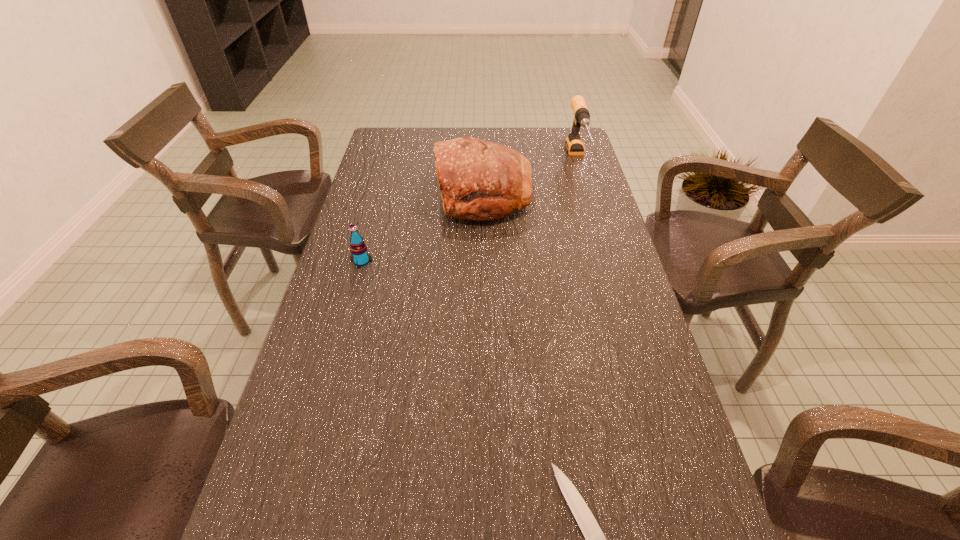
Locate an element on the screen. The height and width of the screenshot is (540, 960). free spot between the soda and the bread is located at coordinates (422, 227).

Identify the location of object that stands as the closest to the rightmost object. (479, 180).

Locate an element on the screen. The height and width of the screenshot is (540, 960). object that is the third closest one to the nearest object is located at coordinates (574, 145).

Identify the location of vacant area in the image that satisfies the following two spatial constraints: 1. on the handle side of the drill; 2. at the sliced front of the bread. The height and width of the screenshot is (540, 960). (588, 194).

Identify the location of vacant point that satisfies the following two spatial constraints: 1. on the handle side of the drill; 2. at the sliced front of the bread. 588,194.

Locate an element on the screen. free location that satisfies the following two spatial constraints: 1. on the handle side of the drill; 2. at the sliced front of the bread is located at coordinates (588, 194).

This screenshot has height=540, width=960. Find the location of `free space that satisfies the following two spatial constraints: 1. at the sliced front of the bread; 2. on the front side of the third tallest object`. free space that satisfies the following two spatial constraints: 1. at the sliced front of the bread; 2. on the front side of the third tallest object is located at coordinates (485, 261).